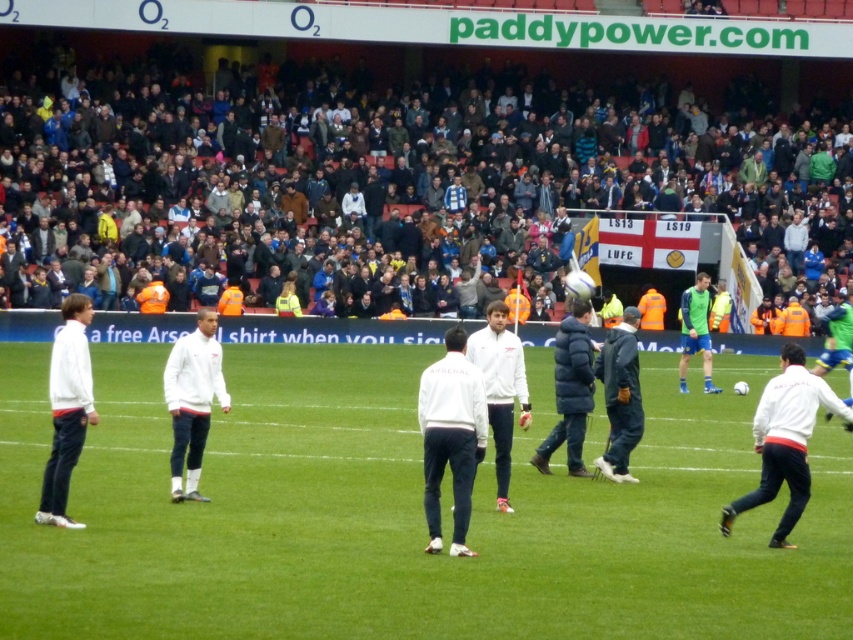
You are a photographer positioned at the origin point of the stadium. You want to capture a photo of the dark gray crowd at upper center. According to the coordinates provided, where should you aim your camera?

The dark gray crowd at upper center is located at coordinates point (372, 168), so you should aim your camera at that point to capture them.

You are a photographer standing at the edge of the pitch. You want to take a photo that includes both the green grass field at center and the white matte jacket at lower right. Given that your camera has a maximum focus range of 20 feet, will you be able to capture both subjects clearly in the same frame?

The green grass field at center and white matte jacket at lower right are 23.09 feet apart. Since the distance between them exceeds the camera maximum focus range of 20 feet, you won wait be able to capture both subjects clearly in the same frame.

You are a photographer standing at the edge of the pitch. You want to take a photo of the green grass field at center and the white matte jacket at lower right. Which object will appear larger in the photo?

The white matte jacket at lower right will appear larger in the photo because it is taller than the green grass field at center.